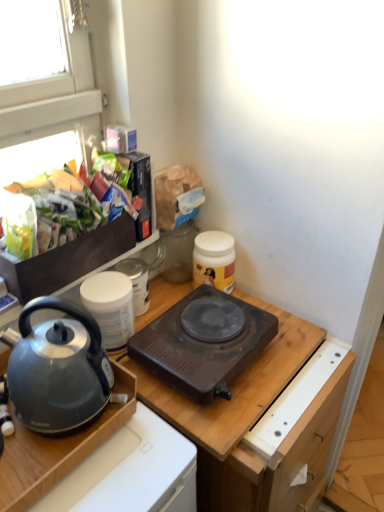
Question: In the image, is dark brown plastic hot plate at center, positioned as the second kitchen appliance in right-to-left order, positioned in front of or behind matte gray kettle at left?

Choices:
 (A) behind
 (B) front

Answer: (A)

Question: From the image's perspective, relative to matte gray kettle at left, is dark brown plastic hot plate at center, arranged as the second kitchen appliance when viewed from the left, above or below?

Choices:
 (A) below
 (B) above

Answer: (A)

Question: Which of these objects is positioned closest to the metallic gray kettle at left?

Choices:
 (A) white matte jar at center
 (B) shiny plastic bag of chips at upper left
 (C) wooden cutting board at center
 (D) dark brown plastic hot plate at center, positioned as the second kitchen appliance in right-to-left order
 (E) matte gray kettle at left

Answer: (E)

Question: Which object is positioned closest to the metallic gray kettle at left?

Choices:
 (A) matte gray kettle at left
 (B) white matte container at upper left, arranged as the 3th kitchen appliance when viewed from the right
 (C) shiny plastic bag of chips at upper left
 (D) yellow matte jar at upper right, which appears as the 3th kitchen appliance when viewed from the left
 (E) wooden cutting board at center

Answer: (A)